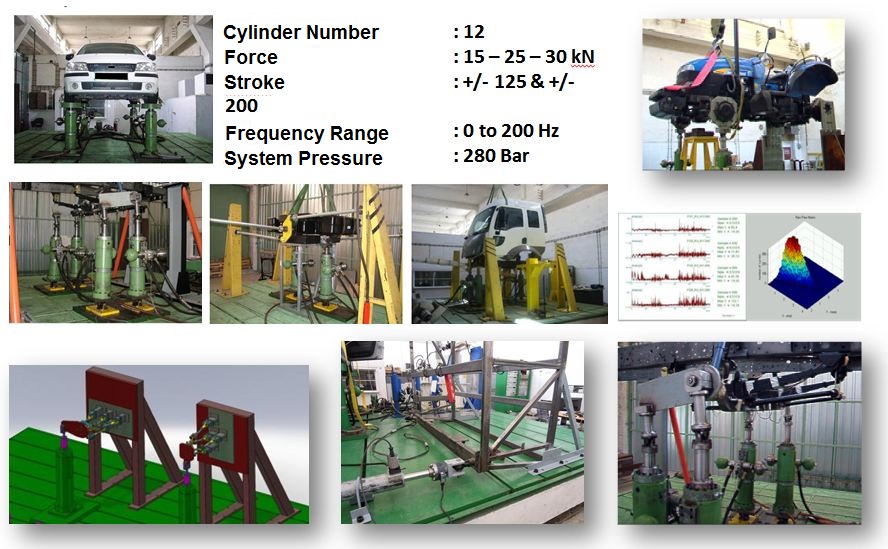
Identify the location of lights. (58, 46), (43, 25), (160, 41).